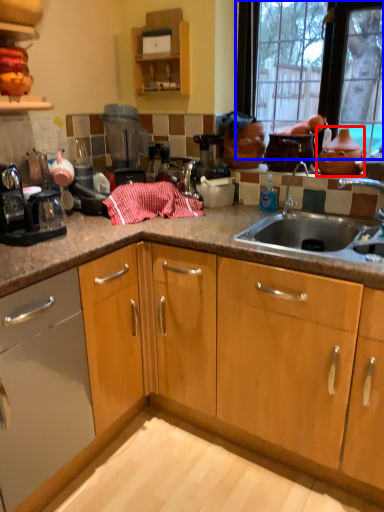
Question: Which of the following is the closest to the observer, tea pot (highlighted by a red box) or window (highlighted by a blue box)?

Choices:
 (A) tea pot
 (B) window

Answer: (B)